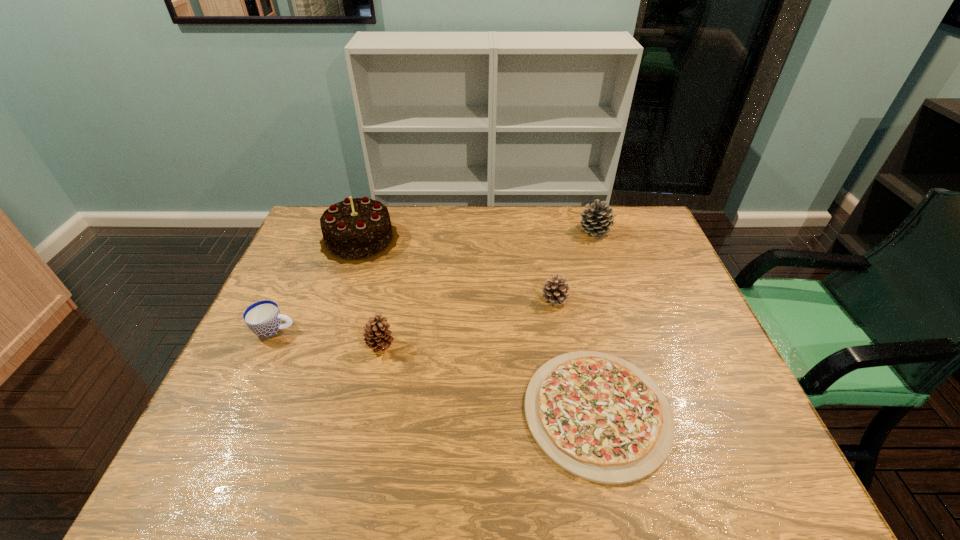
Locate an element on the screen. Image resolution: width=960 pixels, height=540 pixels. vacant space located 0.060m on the back of the second farthest pinecone is located at coordinates (551, 276).

Where is `vacant position located 0.400m on the side of the fifth tallest object with the handle`? The image size is (960, 540). vacant position located 0.400m on the side of the fifth tallest object with the handle is located at coordinates [444, 330].

At what (x,y) coordinates should I click in order to perform the action: click on free space located on the back of the shortest object. Please return your answer as a coordinate pair (x, y). The image size is (960, 540). Looking at the image, I should click on (568, 278).

Image resolution: width=960 pixels, height=540 pixels. What are the coordinates of `birthday cake that is at the far edge` in the screenshot? It's located at (359, 230).

Image resolution: width=960 pixels, height=540 pixels. What are the coordinates of `pinecone positioned at the far edge` in the screenshot? It's located at (596, 221).

The height and width of the screenshot is (540, 960). I want to click on object present at the near edge, so click(x=600, y=418).

Locate an element on the screen. This screenshot has height=540, width=960. birthday cake that is positioned at the left edge is located at coordinates (359, 230).

The image size is (960, 540). Identify the location of cup located at the left edge. (263, 318).

Where is `object that is at the right edge`? The height and width of the screenshot is (540, 960). object that is at the right edge is located at coordinates (596, 221).

Find the location of a particular element. The image size is (960, 540). object at the far left corner is located at coordinates 359,230.